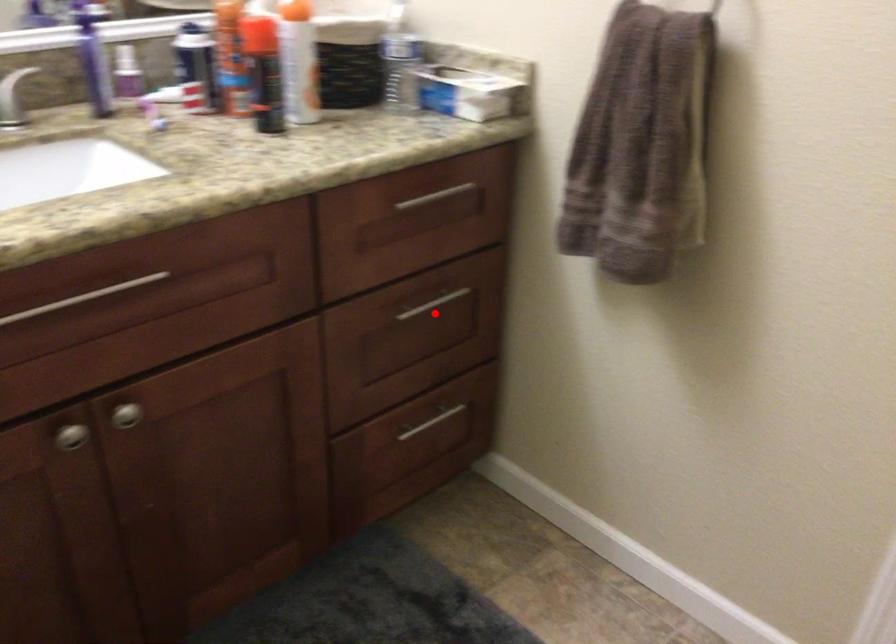
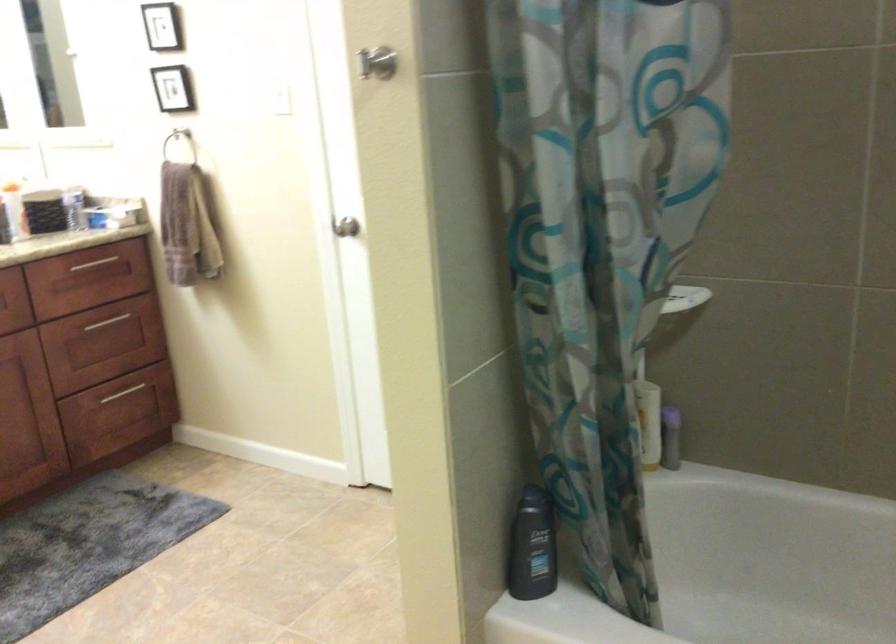
Find the pixel in the second image that matches the highlighted location in the first image.

(115, 323)